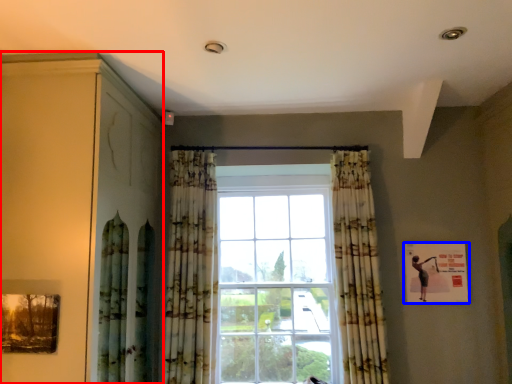
Question: Which point is further to the camera, dresser (highlighted by a red box) or picture frame (highlighted by a blue box)?

Choices:
 (A) dresser
 (B) picture frame

Answer: (B)